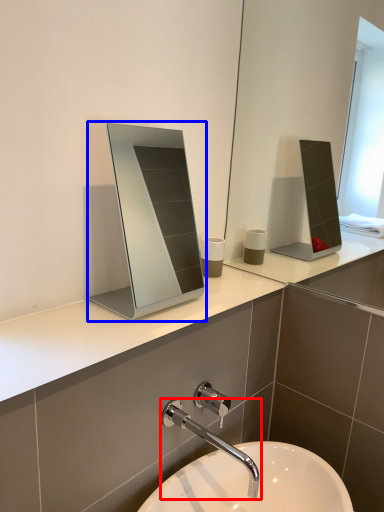
Question: Which point is closer to the camera, tap (highlighted by a red box) or medicine cabinet (highlighted by a blue box)?

Choices:
 (A) tap
 (B) medicine cabinet

Answer: (A)